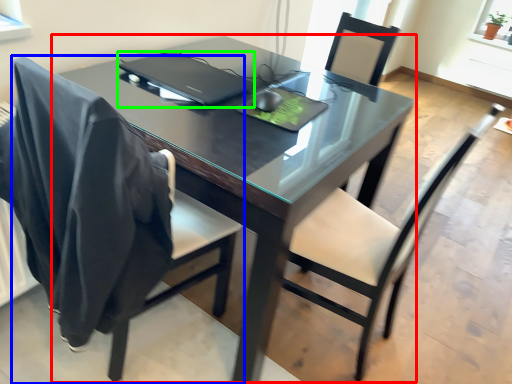
Question: Which is farther away from table (highlighted by a red box)? chair (highlighted by a blue box) or laptop (highlighted by a green box)?

Choices:
 (A) chair
 (B) laptop

Answer: (A)